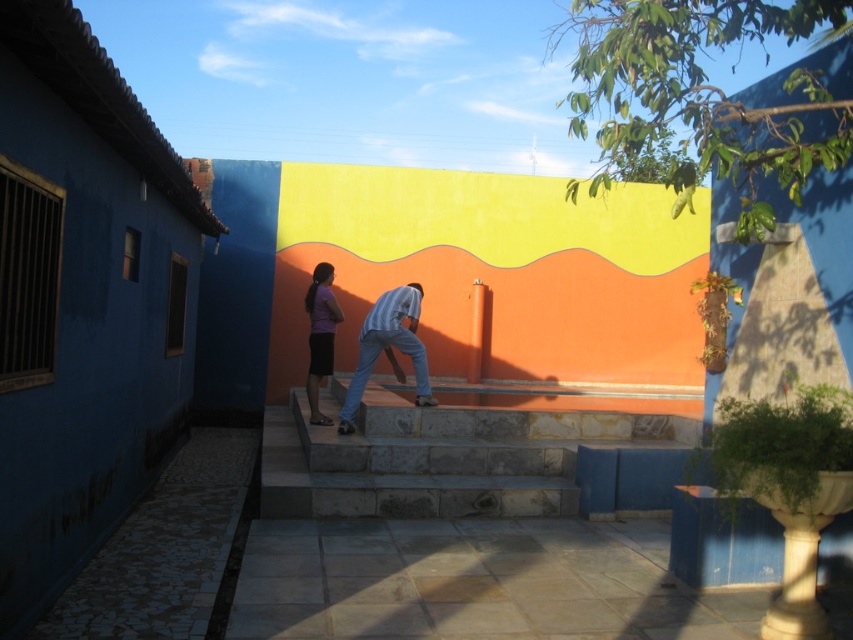
This screenshot has width=853, height=640. What are the coordinates of `light blue jeans at center` in the screenshot? It's located at (387, 348).

Does light blue jeans at center have a greater width compared to purple matte skirt at center?

Indeed, light blue jeans at center has a greater width compared to purple matte skirt at center.

Locate an element on the screen. Image resolution: width=853 pixels, height=640 pixels. light blue jeans at center is located at coordinates [387, 348].

Who is higher up, natural stone stairs at center or light blue jeans at center?

light blue jeans at center is higher up.

Identify the location of natural stone stairs at center. (473, 456).

The width and height of the screenshot is (853, 640). What are the coordinates of `natural stone stairs at center` in the screenshot? It's located at click(x=473, y=456).

Is natural stone stairs at center smaller than purple matte skirt at center?

No.

You are a GUI agent. You are given a task and a screenshot of the screen. Output one action in this format:
    pyautogui.click(x=<x>, y=<y>)
    Task: Click on the natural stone stairs at center
    The image size is (853, 640).
    Given the screenshot: What is the action you would take?
    pyautogui.click(x=473, y=456)

This screenshot has height=640, width=853. I want to click on natural stone stairs at center, so click(x=473, y=456).